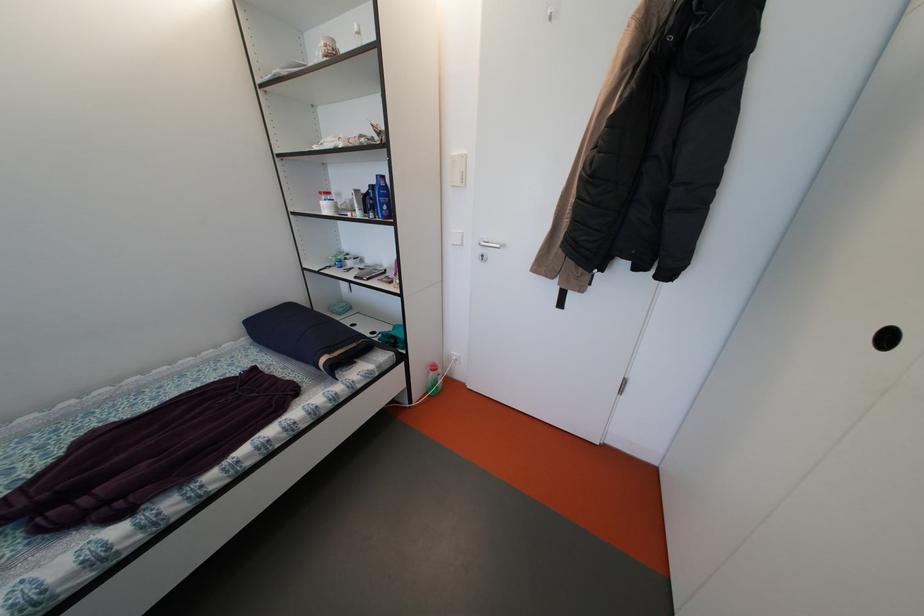
The height and width of the screenshot is (616, 924). What are the coordinates of `blue lotion bottle` in the screenshot? It's located at (382, 198).